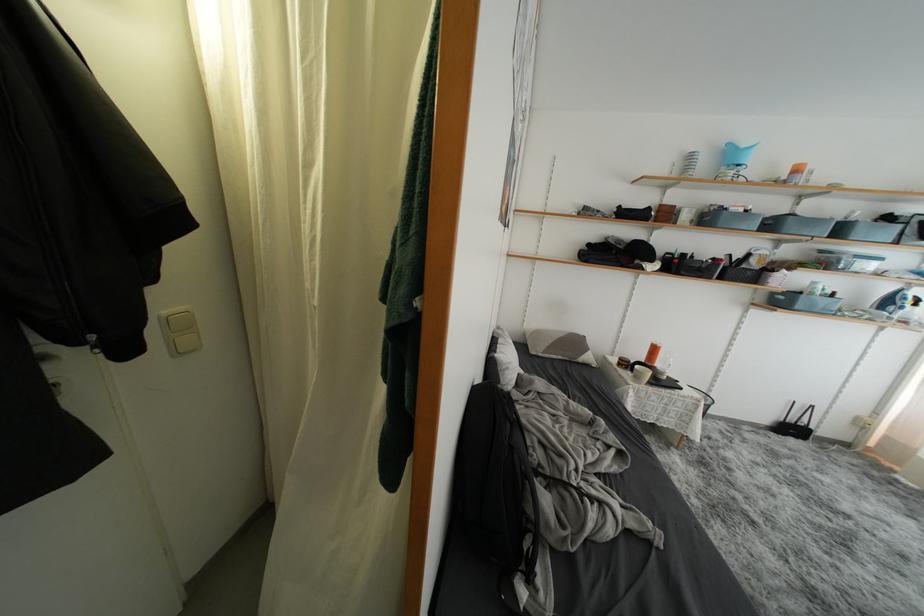
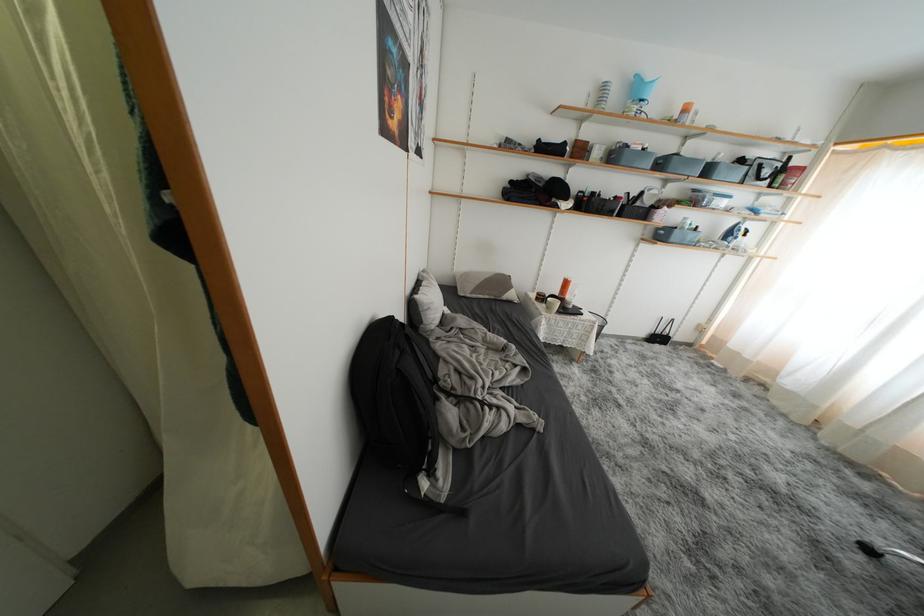
Where in the second image is the point corresponding to the point at 767,304 from the first image?

(654, 238)